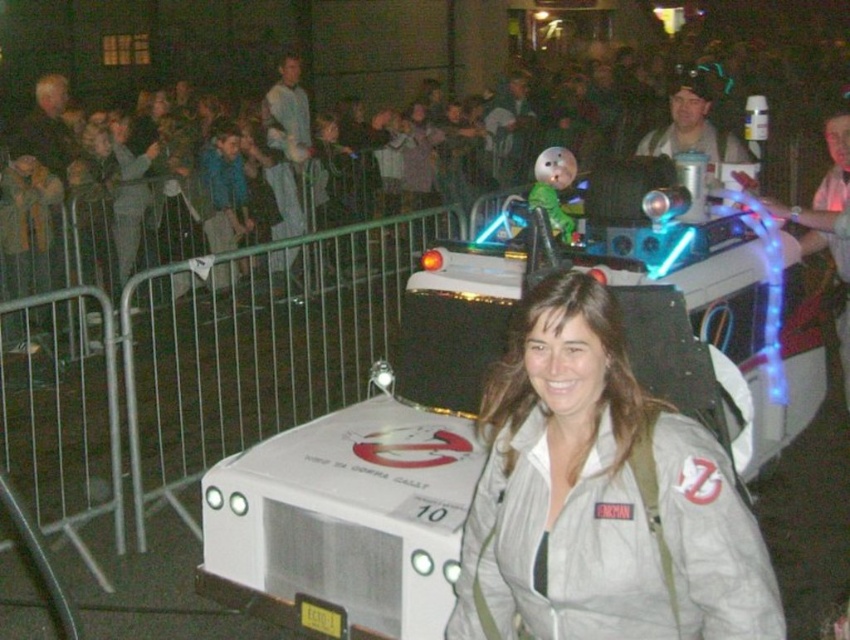
Question: Which point is closer to the camera taking this photo?

Choices:
 (A) (525, 310)
 (B) (588, 154)

Answer: (A)

Question: Which point is farther to the camera?

Choices:
 (A) white matte jacket at center
 (B) dark clothing crowd at upper center

Answer: (B)

Question: Considering the relative positions of dark clothing crowd at upper center and white matte jacket at center in the image provided, where is dark clothing crowd at upper center located with respect to white matte jacket at center?

Choices:
 (A) left
 (B) right

Answer: (B)

Question: Is the position of dark clothing crowd at upper center less distant than that of white matte jacket at center?

Choices:
 (A) yes
 (B) no

Answer: (B)

Question: Does dark clothing crowd at upper center come behind white matte jacket at center?

Choices:
 (A) yes
 (B) no

Answer: (A)

Question: Which point is farther to the camera?

Choices:
 (A) (222, 90)
 (B) (620, 324)

Answer: (A)